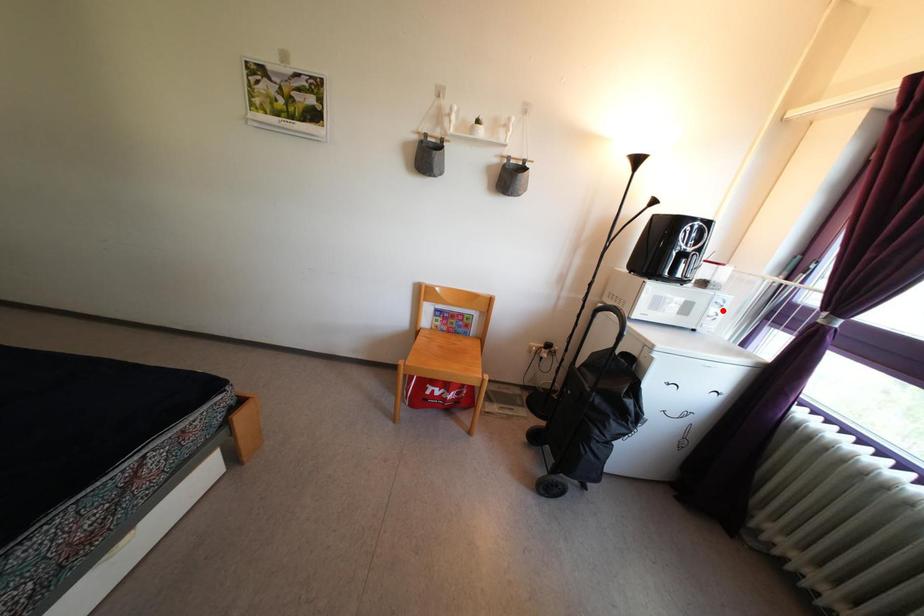
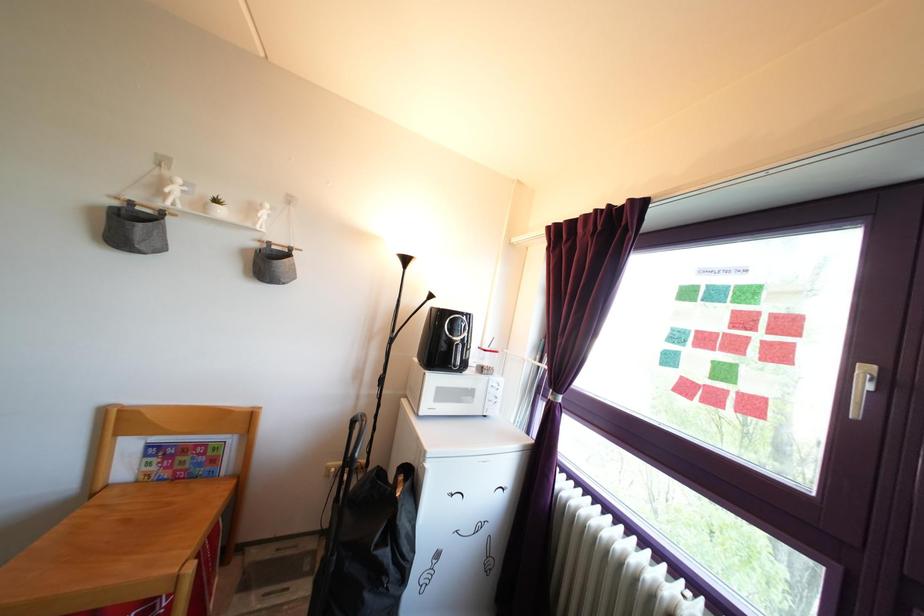
In the second image, find the point that corresponds to the highlighted location in the first image.

(499, 394)